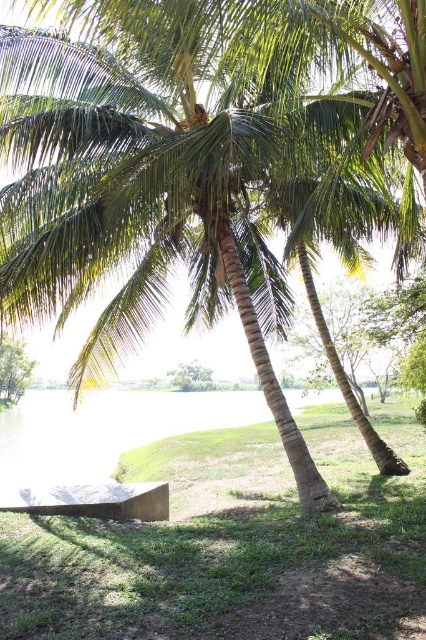
Can you confirm if wooden bench at lower left is positioned to the right of green leafy tree at center?

No, wooden bench at lower left is not to the right of green leafy tree at center.

Is point (131, 513) farther from viewer compared to point (198, 388)?

No, (131, 513) is closer to viewer.

Find the location of `wooden bench at lower left`. wooden bench at lower left is located at coordinates (97, 500).

The height and width of the screenshot is (640, 426). What do you see at coordinates (14, 369) in the screenshot? I see `green leafy palm tree at lower left` at bounding box center [14, 369].

Is point (14, 378) behind point (210, 387)?

Yes, point (14, 378) is behind point (210, 387).

Describe the element at coordinates (14, 369) in the screenshot. The width and height of the screenshot is (426, 640). I see `green leafy palm tree at lower left` at that location.

Where is `green leafy palm tree at lower left`? This screenshot has height=640, width=426. green leafy palm tree at lower left is located at coordinates (14, 369).

Looking at this image, is wooden bench at lower left positioned at the back of green leafy palm tree at lower left?

No, it is in front of green leafy palm tree at lower left.

Between point (92, 502) and point (22, 349), which one is positioned in front?

Point (92, 502) is in front.

This screenshot has width=426, height=640. What do you see at coordinates (97, 500) in the screenshot?
I see `wooden bench at lower left` at bounding box center [97, 500].

You are a GUI agent. You are given a task and a screenshot of the screen. Output one action in this format:
    pyautogui.click(x=<x>, y=<y>)
    Task: Click on the wooden bench at lower left
    This screenshot has height=640, width=426.
    Given the screenshot: What is the action you would take?
    pyautogui.click(x=97, y=500)